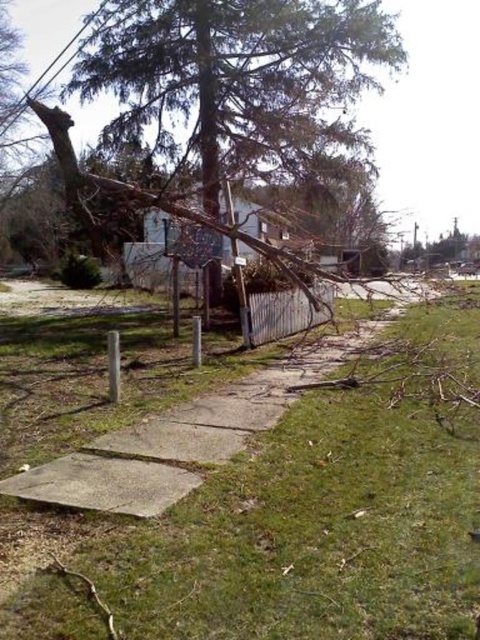
Can you confirm if green textured tree at upper center is shorter than white wood fence at center?

Yes.

Does point (208, 177) come farther from viewer compared to point (264, 301)?

Yes, it is behind point (264, 301).

Where is `green textured tree at upper center`? green textured tree at upper center is located at coordinates (241, 83).

Between green grass at lower center and brown rough bark tree at right, which one appears on the right side from the viewer's perspective?

From the viewer's perspective, brown rough bark tree at right appears more on the right side.

Is point (405, 465) behind point (439, 241)?

No, it is not.

Locate an element on the screen. The width and height of the screenshot is (480, 640). green grass at lower center is located at coordinates (269, 504).

This screenshot has width=480, height=640. I want to click on green grass at lower center, so click(x=269, y=504).

Is green grass at lower center to the right of white wood fence at center from the viewer's perspective?

Yes, green grass at lower center is to the right of white wood fence at center.

Is green grass at lower center further to the viewer compared to white wood fence at center?

No.

Locate an element on the screen. Image resolution: width=480 pixels, height=640 pixels. green grass at lower center is located at coordinates (269, 504).

Locate an element on the screen. green grass at lower center is located at coordinates (269, 504).